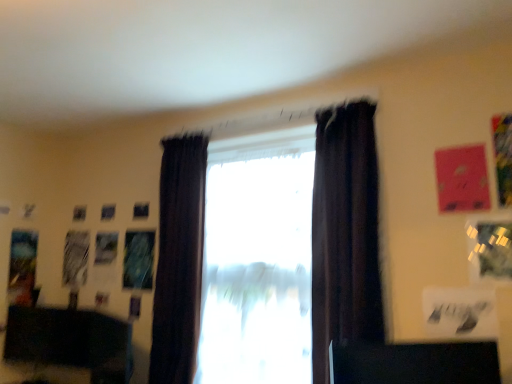
Question: Is dark velvet curtain at center, which is counted as the second curtain, starting from the left, to the right of transparent glass window at center, acting as the first window starting from the right, from the viewer's perspective?

Choices:
 (A) no
 (B) yes

Answer: (B)

Question: Is dark velvet curtain at center, arranged as the 1th curtain when viewed from the right, closer to the viewer compared to transparent glass window at center, acting as the first window starting from the right?

Choices:
 (A) yes
 (B) no

Answer: (A)

Question: From the image's perspective, is dark velvet curtain at center, the first curtain positioned from the front, beneath transparent glass window at center, which ranks as the 2th window in left-to-right order?

Choices:
 (A) no
 (B) yes

Answer: (A)

Question: From a real-world perspective, is dark velvet curtain at center, the first curtain positioned from the front, on top of transparent glass window at center, which ranks as the 2th window in left-to-right order?

Choices:
 (A) no
 (B) yes

Answer: (B)

Question: Considering the relative sizes of dark velvet curtain at center, arranged as the 1th curtain when viewed from the right, and transparent glass window at center, acting as the first window starting from the right, in the image provided, is dark velvet curtain at center, arranged as the 1th curtain when viewed from the right, taller than transparent glass window at center, acting as the first window starting from the right,?

Choices:
 (A) yes
 (B) no

Answer: (A)

Question: Considering the relative sizes of dark velvet curtain at center, the second curtain from the back, and transparent glass window at center, which ranks as the 2th window in left-to-right order, in the image provided, is dark velvet curtain at center, the second curtain from the back, thinner than transparent glass window at center, which ranks as the 2th window in left-to-right order,?

Choices:
 (A) no
 (B) yes

Answer: (A)

Question: Does dark fabric curtain at center, the 2th curtain from the right, appear on the left side of black matte desk at lower left, which is counted as the 1th furniture, starting from the left?

Choices:
 (A) no
 (B) yes

Answer: (A)

Question: Does dark fabric curtain at center, marked as the 2th curtain in a front-to-back arrangement, have a lesser height compared to black matte desk at lower left, acting as the first furniture starting from the back?

Choices:
 (A) no
 (B) yes

Answer: (A)

Question: From a real-world perspective, is dark fabric curtain at center, the 2th curtain from the right, on black matte desk at lower left, which ranks as the 2th furniture in front-to-back order?

Choices:
 (A) no
 (B) yes

Answer: (B)

Question: Is dark fabric curtain at center, acting as the first curtain starting from the back, looking in the opposite direction of black matte desk at lower left, arranged as the second furniture when viewed from the top?

Choices:
 (A) yes
 (B) no

Answer: (B)

Question: Does dark fabric curtain at center, the 2th curtain from the right, have a greater height compared to black matte desk at lower left, acting as the first furniture starting from the back?

Choices:
 (A) no
 (B) yes

Answer: (B)

Question: Can you confirm if dark fabric curtain at center, the 2th curtain from the right, is wider than black matte desk at lower left, the 1th furniture positioned from the bottom?

Choices:
 (A) yes
 (B) no

Answer: (A)

Question: From the image's perspective, does dark fabric curtain at center, the 1th curtain when ordered from left to right, appear lower than dark velvet curtain at center, the second curtain from the back?

Choices:
 (A) no
 (B) yes

Answer: (B)